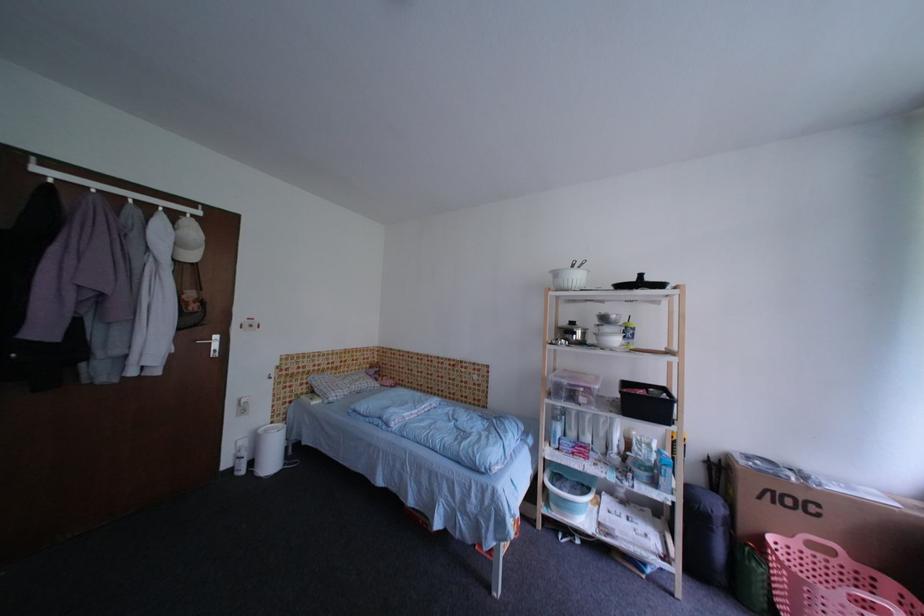
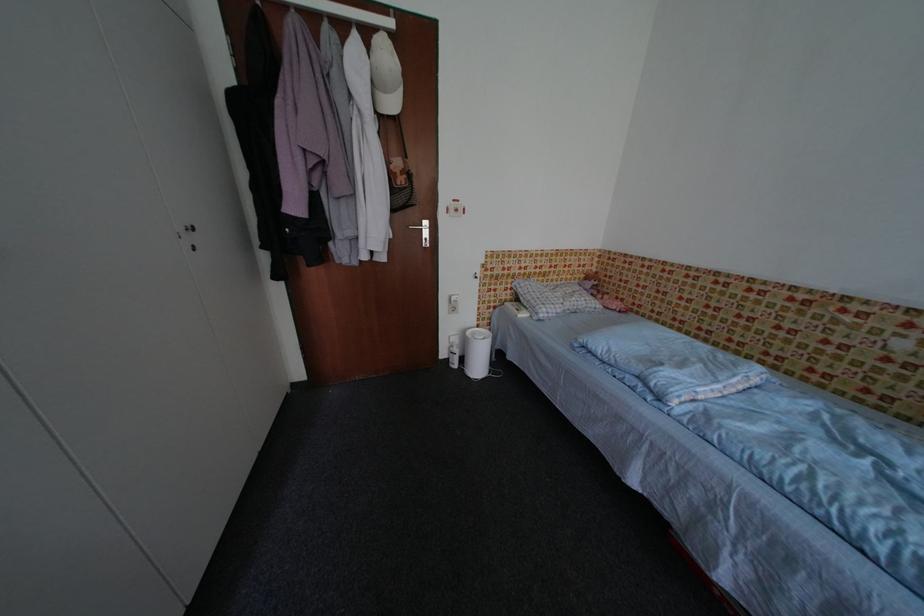
Find the pixel in the second image that matches (252,445) in the first image.

(464, 342)